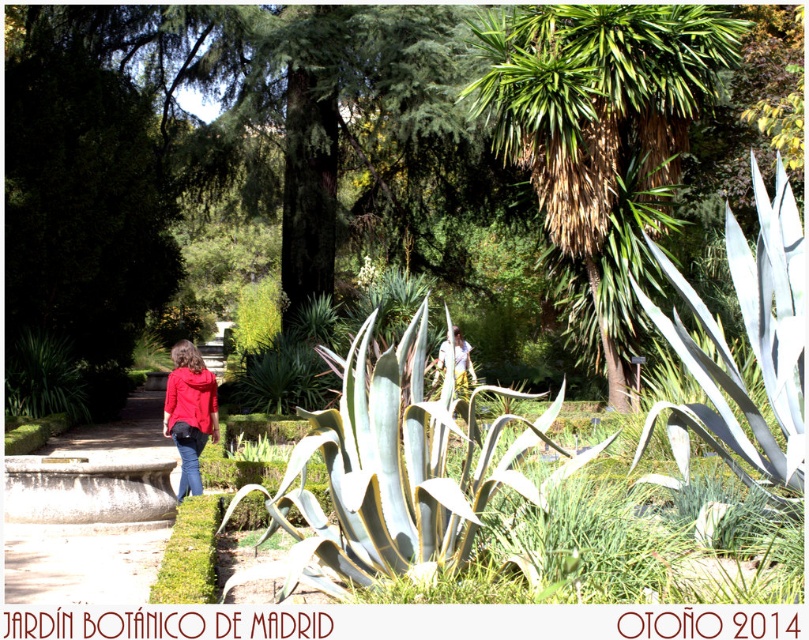
In the scene shown: You are standing at the entrance of the Jardn Botnico de Madrid and see a person wearing a matte red jacket at center and another with light brown hair at center. Which object is closer to you?

The matte red jacket at center is closer to the viewer than the light brown hair at center.

You are a photographer in the Jard?n Bot?nico de Madrid during autumn 2014. You notice two red garments at the center of your viewfinder. Which one is taller between the matte red hoodie at center and the matte red jacket at center?

The matte red hoodie at center is taller than the matte red jacket at center according to the description.

You are a photographer standing at the entrance of the Jardn Botnico de Madrid and you see a person wearing a matte red hoodie at center and another with light brown hair at center. Which object is more to the left?

The matte red hoodie at center is positioned on the left side of light brown hair at center, so the matte red hoodie at center is more to the left.